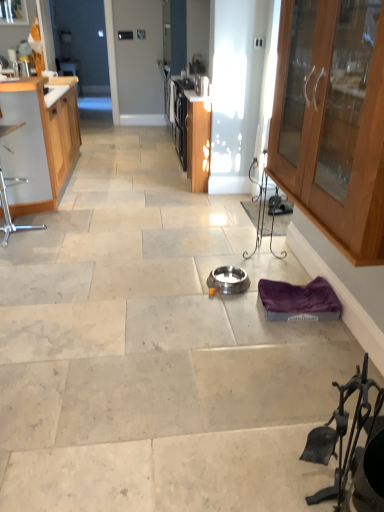
Identify the location of free space to the back side of satin silver bowl at center, the second appliance viewed from the left. Image resolution: width=384 pixels, height=512 pixels. (222, 262).